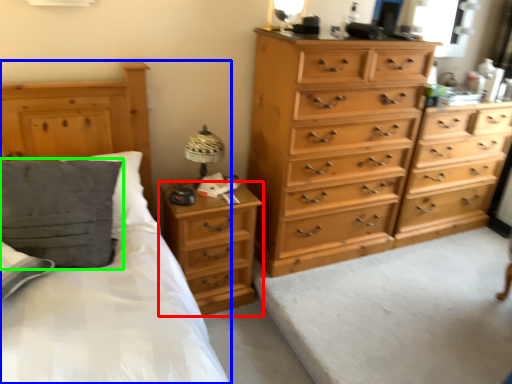
Question: Considering the real-world distances, which object is farthest from nightstand (highlighted by a red box)? bed (highlighted by a blue box) or pillow (highlighted by a green box)?

Choices:
 (A) bed
 (B) pillow

Answer: (B)